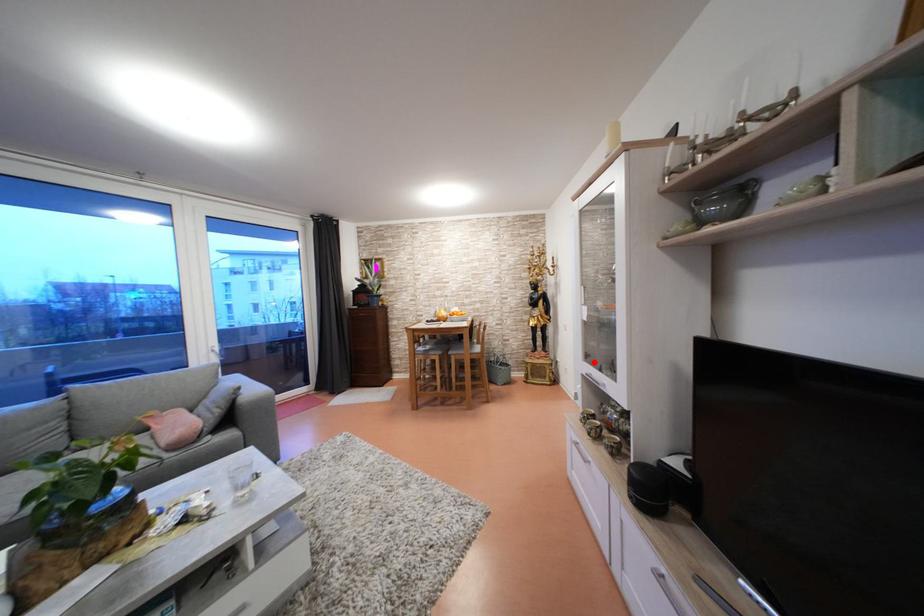
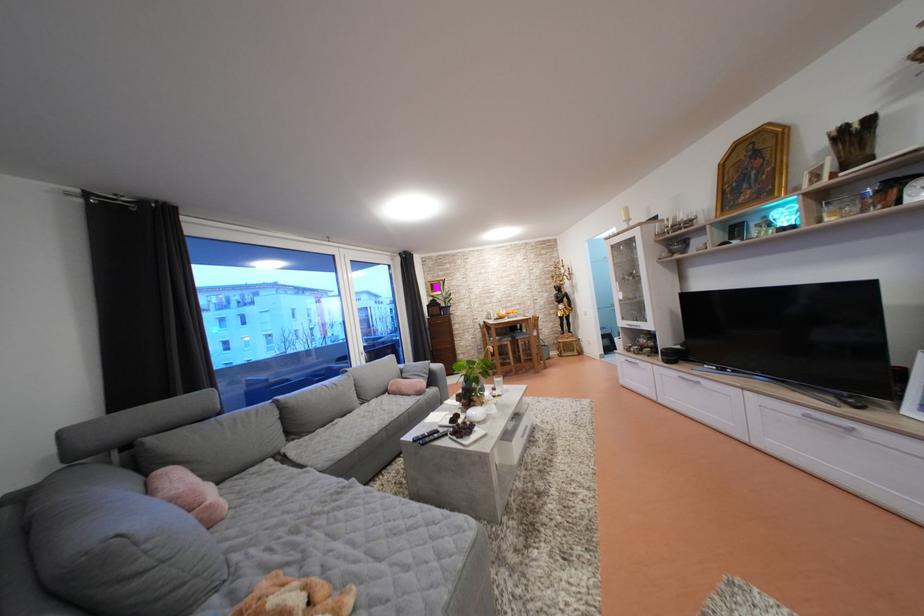
Question: I am providing you with two images of the same scene from different viewpoints. Image1 has a red point marked. In image2, the corresponding 3D location appears at what relative position? Reply with the corresponding letter.

Choices:
 (A) Closer
 (B) Farther

Answer: (B)